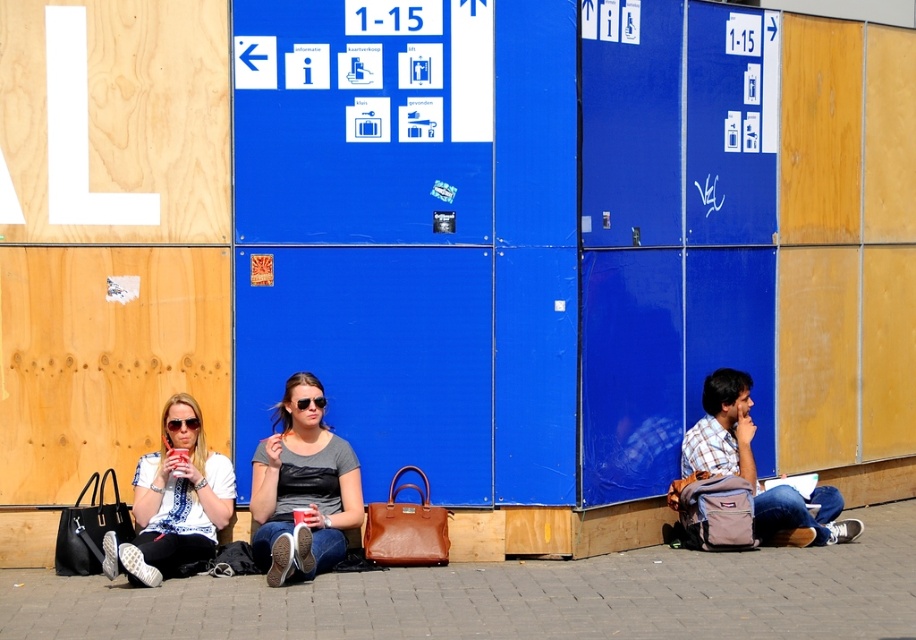
You are standing on the smooth concrete pavement at center and want to place the plaid cotton shirt at lower right on the pavement. Will the shirt fit entirely on the pavement without overlapping the edges?

The smooth concrete pavement at center is wider than the plaid cotton shirt at lower right, so the shirt will fit entirely on the pavement without overlapping the edges.

You are a photographer trying to capture a closeup of the matte gray shirt at center and the matte white sunglasses at left. Which object should you focus on first to ensure both are in frame without moving the camera?

The matte gray shirt at center is much taller than the matte white sunglasses at left, so you should focus on the matte gray shirt at center first to ensure both are in frame.

You are standing in the scene and notice two items at the center of the image. One is the smooth concrete pavement at center and the other is the matte gray shirt at center. Which one takes up more area in the image?

The matte gray shirt at center takes up more area than the smooth concrete pavement at center because the smooth concrete pavement at center occupies less space than matte gray shirt at center.